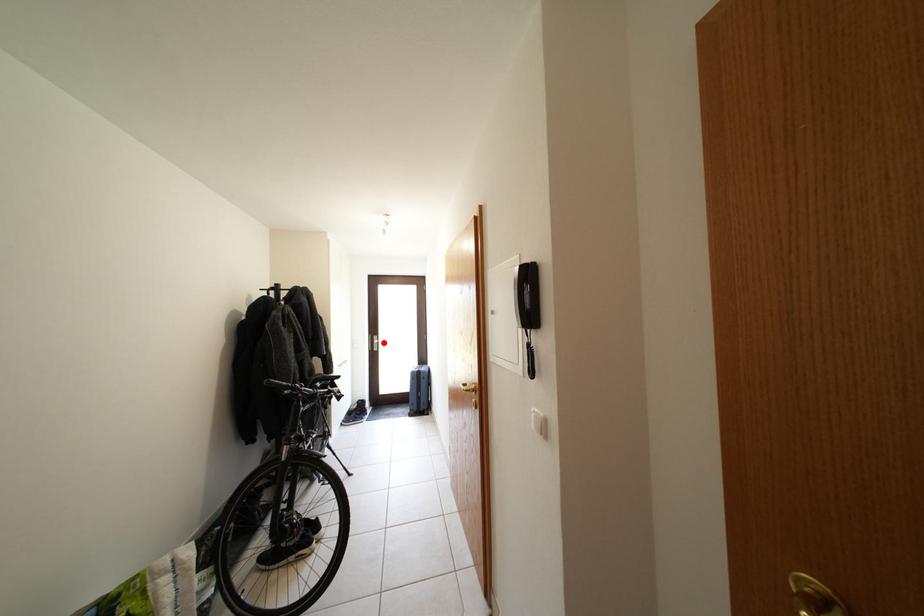
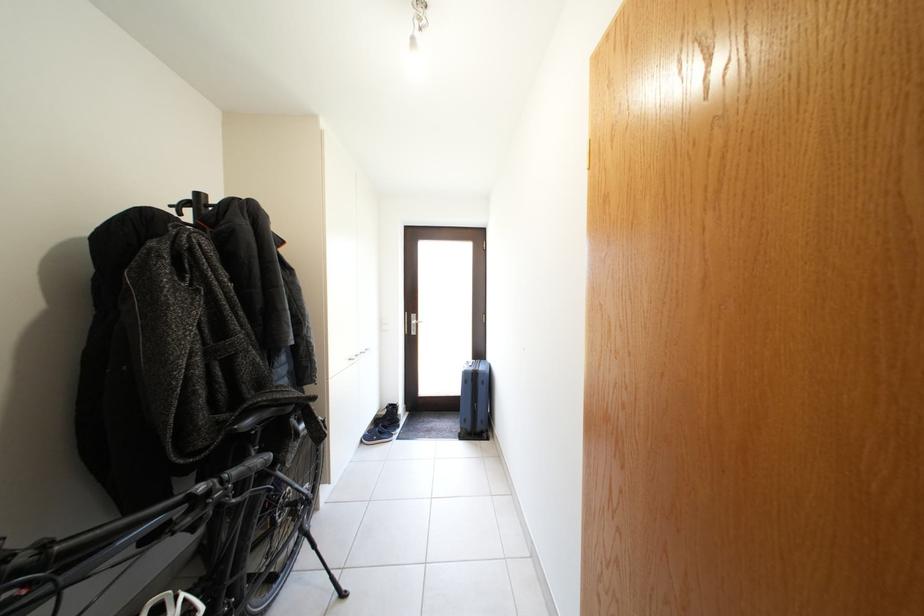
Locate, in the second image, the point that corresponds to the highlighted location in the first image.

(421, 322)